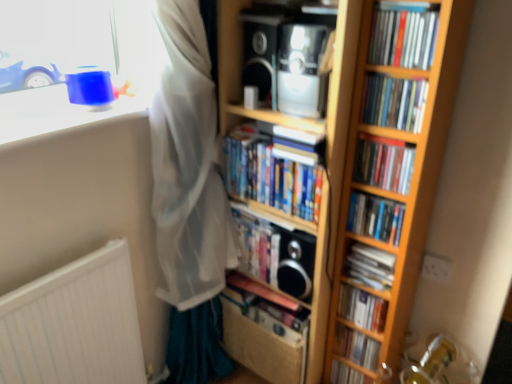
Question: Is hardcover books at center, placed as the 7th book when sorted from bottom to top, surrounding hardcover book at center, the second book ordered from the bottom?

Choices:
 (A) no
 (B) yes

Answer: (A)

Question: Is hardcover books at center, the 4th book when ordered from top to bottom, further to camera compared to hardcover book at center, which is counted as the ninth book, starting from the top?

Choices:
 (A) no
 (B) yes

Answer: (A)

Question: Is hardcover books at center, placed as the 7th book when sorted from bottom to top, in front of hardcover book at center, the second book ordered from the bottom?

Choices:
 (A) yes
 (B) no

Answer: (A)

Question: Does hardcover books at center, placed as the 7th book when sorted from bottom to top, have a larger size compared to hardcover book at center, the second book ordered from the bottom?

Choices:
 (A) yes
 (B) no

Answer: (A)

Question: Can you confirm if hardcover books at center, placed as the 7th book when sorted from bottom to top, is shorter than hardcover book at center, which is counted as the ninth book, starting from the top?

Choices:
 (A) no
 (B) yes

Answer: (A)

Question: Does hardcover books at center, the 4th book when ordered from top to bottom, appear on the right side of hardcover book at center, which is counted as the ninth book, starting from the top?

Choices:
 (A) yes
 (B) no

Answer: (B)

Question: Considering the relative positions of white matte radiator at lower left and hardcover book at center, which ranks as the 6th book in bottom-to-top order, in the image provided, is white matte radiator at lower left to the right of hardcover book at center, which ranks as the 6th book in bottom-to-top order, from the viewer's perspective?

Choices:
 (A) no
 (B) yes

Answer: (A)

Question: Is hardcover book at center, which ranks as the 6th book in bottom-to-top order, located within white matte radiator at lower left?

Choices:
 (A) no
 (B) yes

Answer: (A)

Question: Is white matte radiator at lower left positioned beyond the bounds of hardcover book at center, the 5th book in the top-to-bottom sequence?

Choices:
 (A) no
 (B) yes

Answer: (B)

Question: Is white matte radiator at lower left closer to camera compared to hardcover book at center, which ranks as the 6th book in bottom-to-top order?

Choices:
 (A) no
 (B) yes

Answer: (B)

Question: Is white matte radiator at lower left turned away from hardcover book at center, the 5th book in the top-to-bottom sequence?

Choices:
 (A) yes
 (B) no

Answer: (B)

Question: Is white matte radiator at lower left smaller than hardcover book at center, the 5th book in the top-to-bottom sequence?

Choices:
 (A) no
 (B) yes

Answer: (A)

Question: Could you tell me if matte black book at center, the 1th book positioned from the bottom, is facing blue plastic toy at upper left?

Choices:
 (A) no
 (B) yes

Answer: (A)